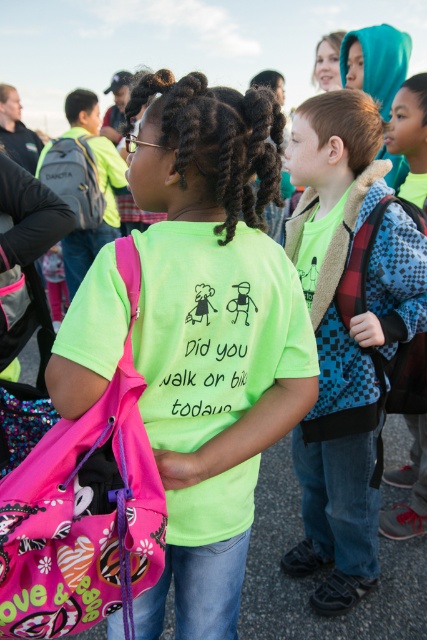
You are a photographer trying to capture a closeup of the checkered fabric backpack at center and the green matte pigtail at center. Which object should you focus on first if you want to ensure both are in focus without moving the camera?

The checkered fabric backpack at center is below the green matte pigtail at center, so you should focus on the green matte pigtail at center first since it is closer to the camera.